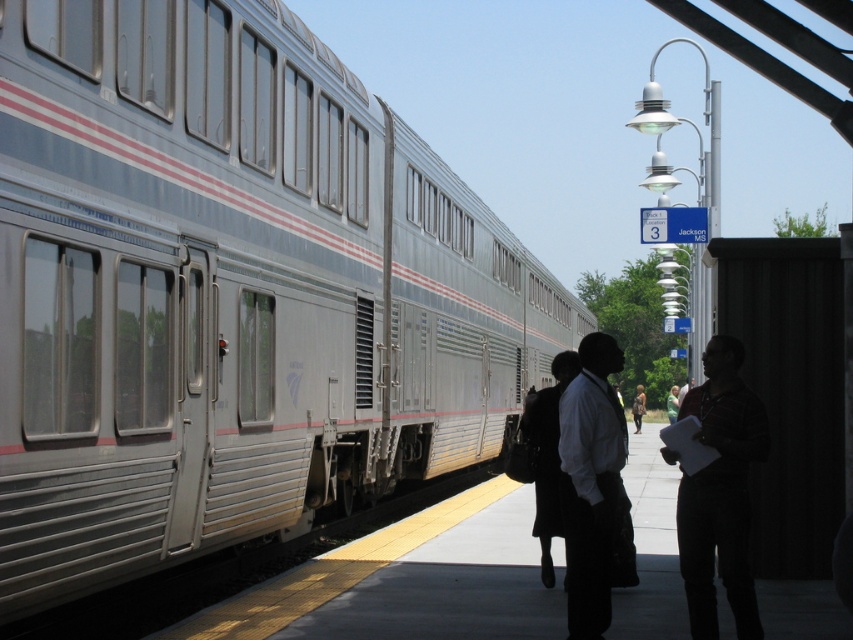
Is point (724, 419) closer to viewer compared to point (730, 392)?

Yes, point (724, 419) is in front of point (730, 392).

Where is `dark gray suit at right`? This screenshot has width=853, height=640. dark gray suit at right is located at coordinates (718, 492).

Between silver metallic train at left and dark gray suit at right, which one appears on the right side from the viewer's perspective?

From the viewer's perspective, silver metallic train at left appears more on the right side.

Between point (136, 509) and point (730, 449), which one is positioned behind?

The point (136, 509) is more distant.

Is point (175, 426) positioned before point (705, 545)?

No, (175, 426) is behind (705, 545).

Locate an element on the screen. silver metallic train at left is located at coordinates (230, 292).

Is dark gray suit at right to the left of dark fabric dress at center from the viewer's perspective?

In fact, dark gray suit at right is to the right of dark fabric dress at center.

Locate an element on the screen. The image size is (853, 640). dark gray suit at right is located at coordinates (718, 492).

The height and width of the screenshot is (640, 853). What are the coordinates of `dark gray suit at right` in the screenshot? It's located at (718, 492).